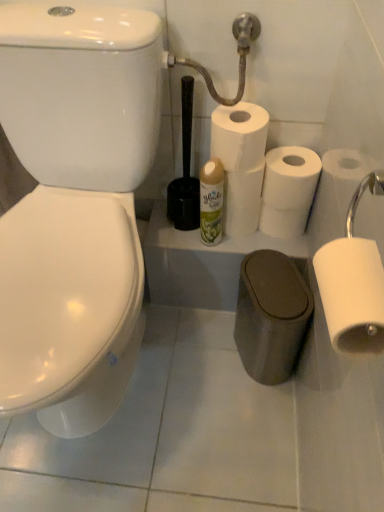
Question: Is white matte toilet paper at center, positioned as the 2th toilet paper in back-to-front order, bigger or smaller than white matte toilet paper at right, which ranks as the 5th toilet paper in back-to-front order?

Choices:
 (A) big
 (B) small

Answer: (A)

Question: In the image, is white matte toilet paper at center, positioned as the 4th toilet paper in front-to-back order, positioned in front of or behind white matte toilet paper at right, which ranks as the 5th toilet paper in back-to-front order?

Choices:
 (A) behind
 (B) front

Answer: (A)

Question: Which of these objects is positioned closest to the white matte toilet paper at center, positioned as the 4th toilet paper in front-to-back order?

Choices:
 (A) white matte toilet paper at right, acting as the first toilet paper starting from the front
 (B) white matte toilet paper at center right, which is counted as the third toilet paper, starting from the front
 (C) white matte toilet paper at center, which is the 2th toilet paper from front to back
 (D) white matte toilet paper at center, which appears as the 1th toilet paper when viewed from the back
 (E) white glossy air freshener at center

Answer: (B)

Question: Which object is positioned farthest from the white matte toilet paper at center right, arranged as the 3th toilet paper when viewed from the back?

Choices:
 (A) black plastic toilet brush at center
 (B) white matte toilet paper at center, which appears as the 1th toilet paper when viewed from the back
 (C) white glossy air freshener at center
 (D) white matte toilet paper at center, positioned as the 4th toilet paper in front-to-back order
 (E) white matte toilet paper at center, which is the 2th toilet paper from front to back

Answer: (A)